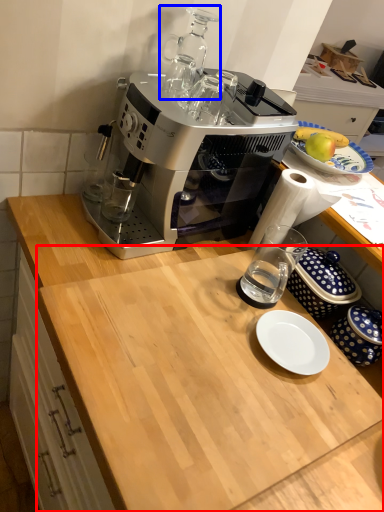
Question: Among these objects, which one is farthest to the camera, counter top (highlighted by a red box) or appliance (highlighted by a blue box)?

Choices:
 (A) counter top
 (B) appliance

Answer: (B)